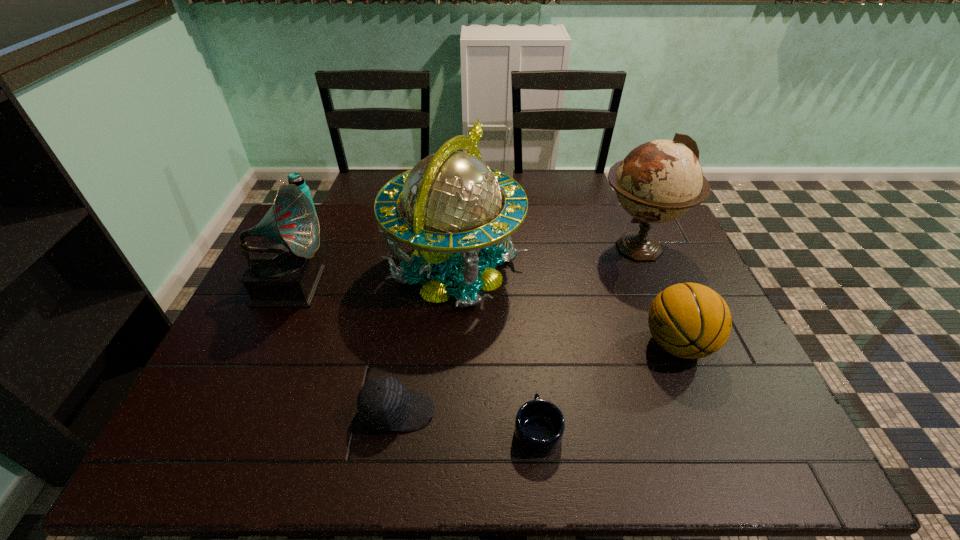
Locate an element on the screen. water bottle positioned at the far edge is located at coordinates (295, 178).

Identify the location of baseball cap at the near edge. (383, 403).

Locate an element on the screen. The width and height of the screenshot is (960, 540). mug at the near edge is located at coordinates (539, 426).

Where is `record player that is at the left edge`? The width and height of the screenshot is (960, 540). record player that is at the left edge is located at coordinates (285, 274).

The height and width of the screenshot is (540, 960). In order to click on water bottle located in the left edge section of the desktop in this screenshot , I will do `click(295, 178)`.

You are a GUI agent. You are given a task and a screenshot of the screen. Output one action in this format:
    pyautogui.click(x=<x>, y=<y>)
    Task: Click on the globe present at the right edge
    Image resolution: width=960 pixels, height=540 pixels.
    Given the screenshot: What is the action you would take?
    pyautogui.click(x=658, y=181)

In order to click on basketball at the right edge in this screenshot , I will do `click(689, 320)`.

This screenshot has width=960, height=540. I want to click on object located in the far left corner section of the desktop, so [x=295, y=178].

Find the location of a particular element. object present at the far right corner is located at coordinates (658, 181).

Where is `free region at the far edge`? The image size is (960, 540). free region at the far edge is located at coordinates (375, 234).